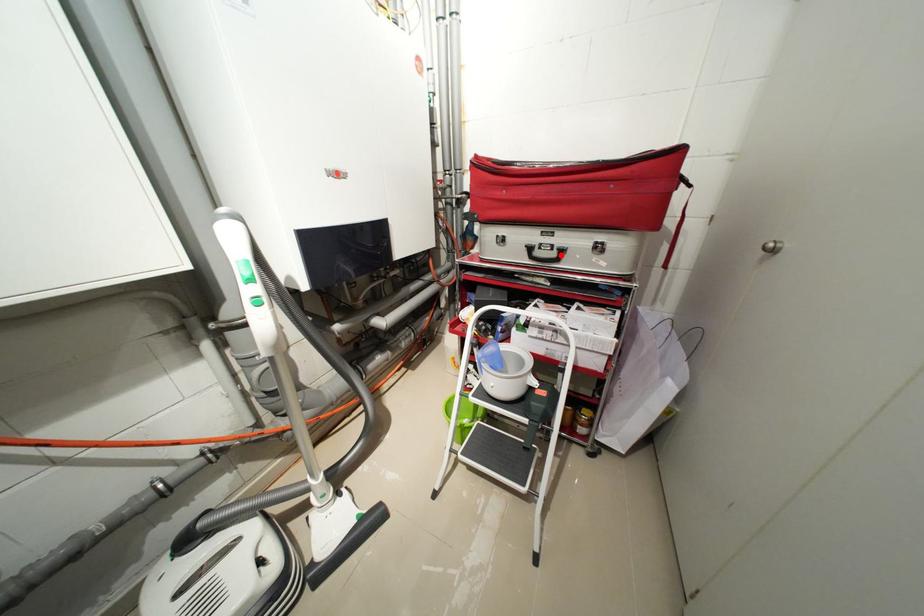
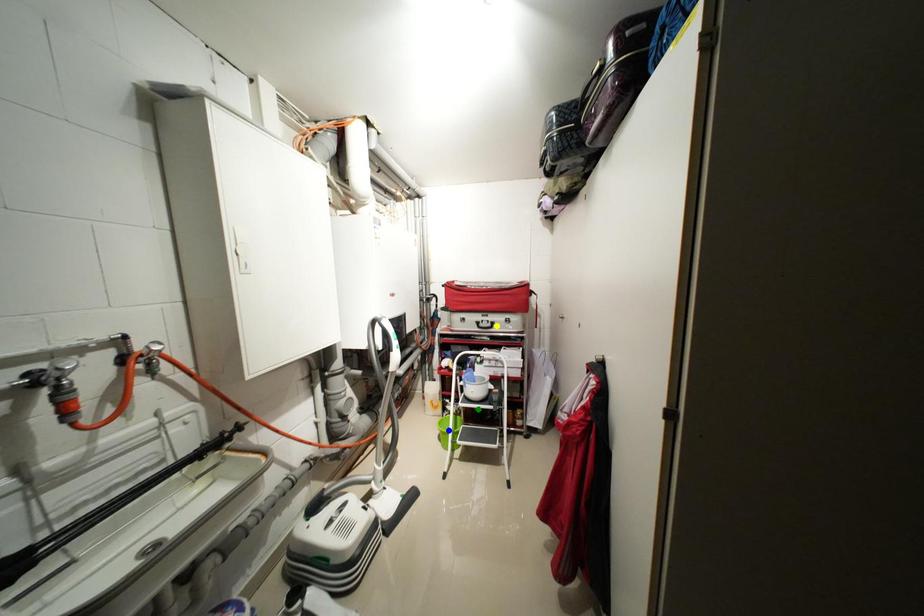
Question: I am providing you with two images of the same scene from different viewpoints. A red point is marked on the first image. You are given multiple points on the second image. Can you choose the point in image 2 that corresponds to the point in image 1?

Choices:
 (A) yellow point
 (B) blue point
 (C) green point

Answer: (A)